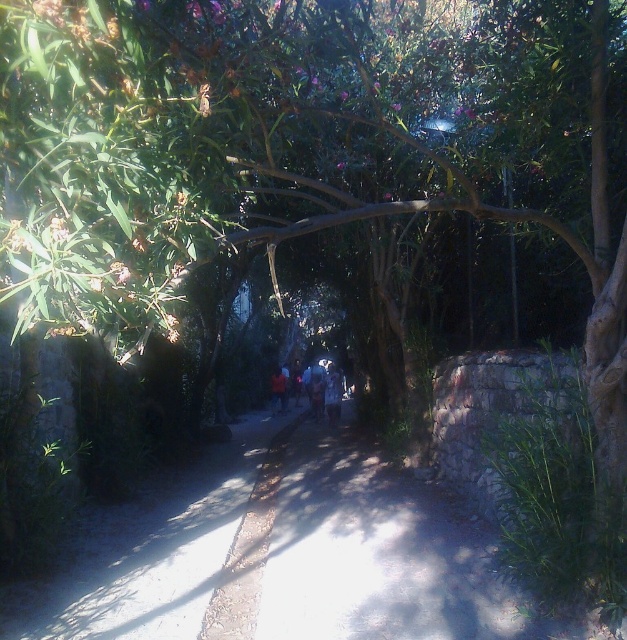
Question: Does matte blue shirt at center appear on the left side of orange fabric at center?

Choices:
 (A) no
 (B) yes

Answer: (A)

Question: Which object is the closest to the blue denim jeans at center?

Choices:
 (A) matte blue shirt at center
 (B) orange fabric at center

Answer: (A)

Question: Which point is farther to the camera?

Choices:
 (A) (332, 420)
 (B) (282, 404)
 (C) (334, 385)

Answer: (B)

Question: Which of these objects is positioned closest to the matte blue shirt at center?

Choices:
 (A) blue denim jeans at center
 (B) dirt path at center
 (C) orange fabric at center

Answer: (A)

Question: Is dirt path at center to the right of orange fabric at center from the viewer's perspective?

Choices:
 (A) no
 (B) yes

Answer: (B)

Question: Does dirt path at center have a greater width compared to matte blue shirt at center?

Choices:
 (A) yes
 (B) no

Answer: (B)